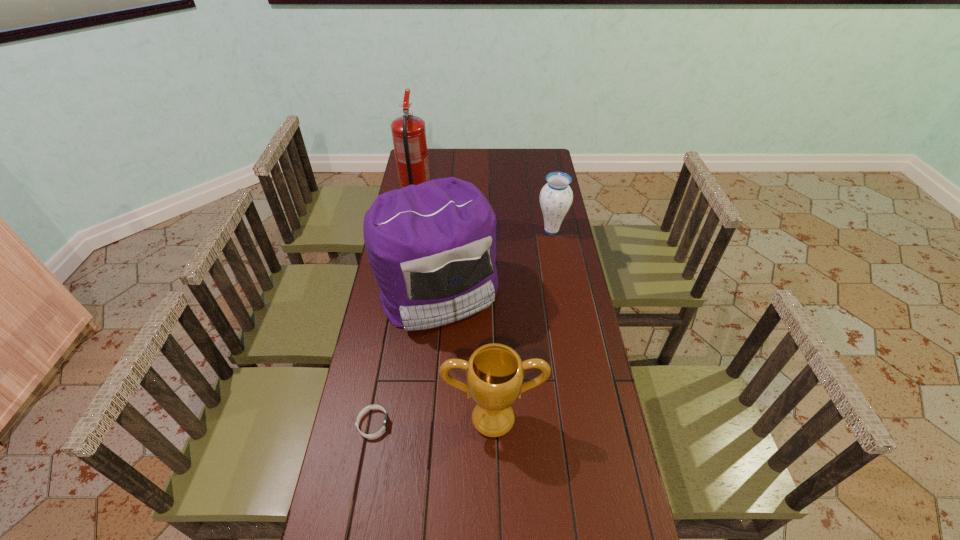
At what (x,y) coordinates should I click in order to perform the action: click on the tallest object. Please return your answer as a coordinate pair (x, y). Image resolution: width=960 pixels, height=540 pixels. Looking at the image, I should click on (408, 132).

Where is `fire extinguisher`? Image resolution: width=960 pixels, height=540 pixels. fire extinguisher is located at coordinates (408, 132).

Locate an element on the screen. The height and width of the screenshot is (540, 960). the third farthest object is located at coordinates (432, 247).

The height and width of the screenshot is (540, 960). What are the coordinates of `backpack` in the screenshot? It's located at (432, 247).

Where is `award`? award is located at coordinates (494, 372).

Image resolution: width=960 pixels, height=540 pixels. What are the coordinates of `the rightmost object` in the screenshot? It's located at (556, 197).

The height and width of the screenshot is (540, 960). Find the location of `the fourth nearest object`. the fourth nearest object is located at coordinates coord(556,197).

Locate an element on the screen. The height and width of the screenshot is (540, 960). wristband is located at coordinates (386, 419).

Locate an element on the screen. The image size is (960, 540). vacant space located on the handle side the farthest object is located at coordinates (426, 157).

Where is `free space located 0.240m on the handle side the farthest object`? The image size is (960, 540). free space located 0.240m on the handle side the farthest object is located at coordinates (424, 167).